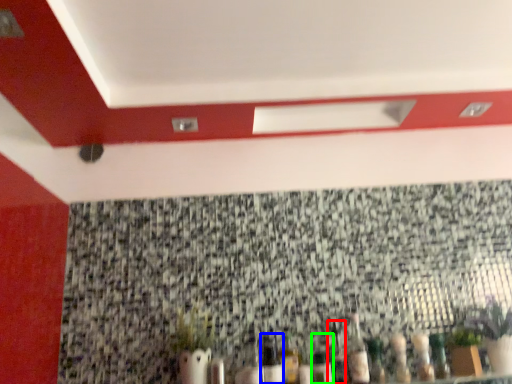
Question: Considering the real-world distances, which object is closest to bottle (highlighted by a red box)? bottle (highlighted by a blue box) or bottle (highlighted by a green box).

Choices:
 (A) bottle
 (B) bottle

Answer: (B)